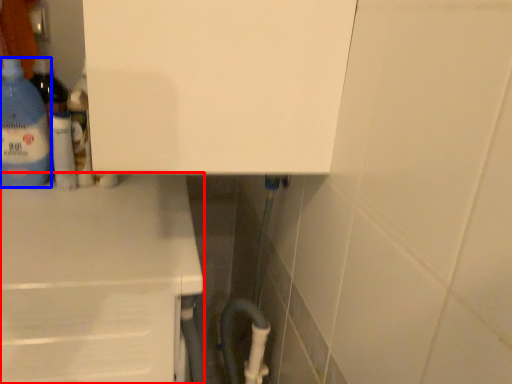
Question: Which of the following is the farthest to the observer, counter (highlighted by a red box) or bottle (highlighted by a blue box)?

Choices:
 (A) counter
 (B) bottle

Answer: (B)